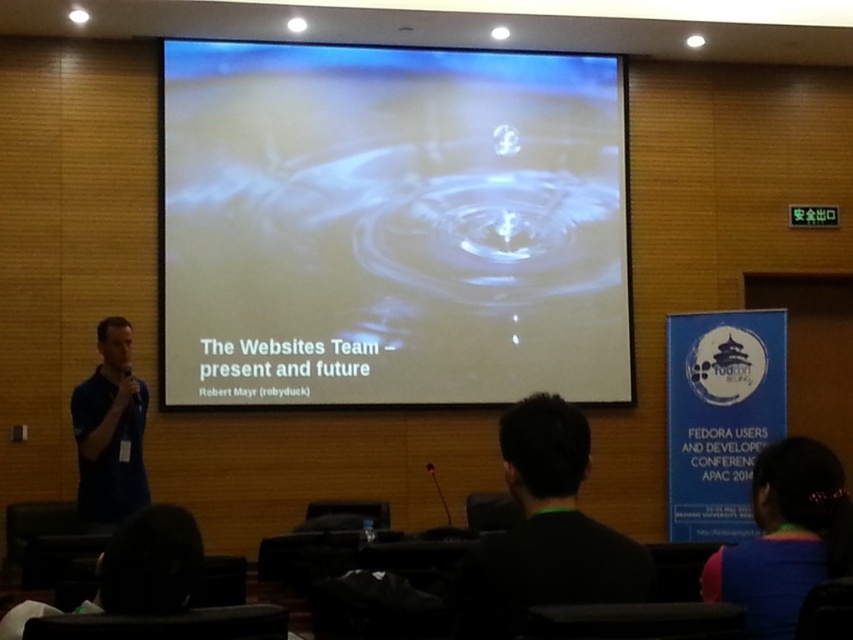
Consider the image. You are an attendee at the presentation. You need to quickly identify which presenter is taller between the black matte shirt at center and the rainbow fabric shirt at lower right. Which one should you look at?

The black matte shirt at center has a greater height compared to the rainbow fabric shirt at lower right, so you should look at the black matte shirt at center as the taller one.

You are standing in the conference room and want to locate the rainbow fabric shirt at lower right. Based on the coordinates provided, where should you look to find it?

The rainbow fabric shirt at lower right is located at the 2D coordinates point (x=785, y=538), so you should look towards the lower right area of the image to find it.